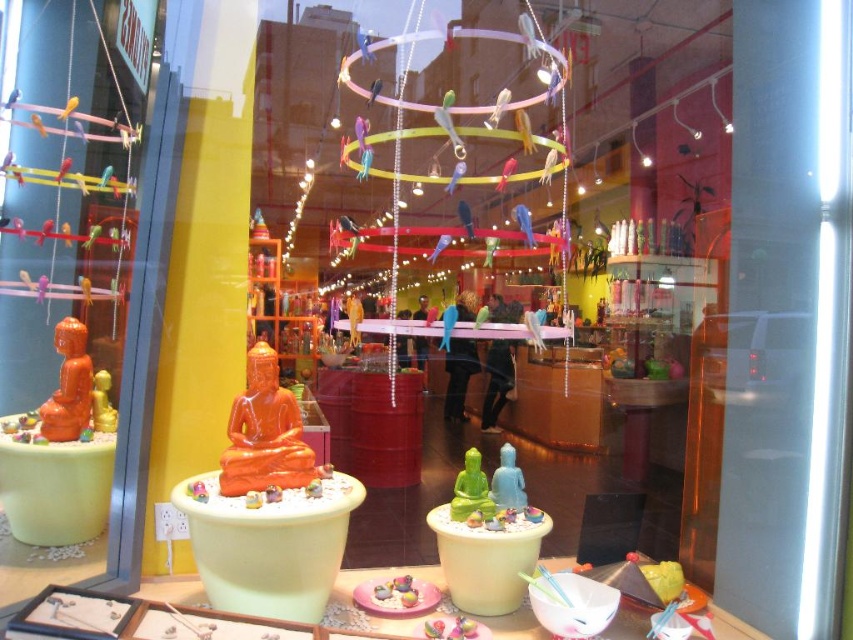
You are a delivery person trying to place a new statue between the orange glossy buddha statue at center and the green matte buddha at center. The statue you have is 16 inches wide. Can it fit in the space between them?

The space between the orange glossy buddha statue at center and the green matte buddha at center is 18.14 inches. Since the statue you have is 16 inches wide, it should fit with some space remaining.

You are a customer looking at the display of orange matte buddha at left and green matte buddha at center. Which one is located more to the left?

The orange matte buddha at left is more to the left than the green matte buddha at center because the orange matte buddha at left is positioned on the left side of green matte buddha at center.

You are standing in front of the vibrant storefront display and notice two points marked in the scene. Which point, point [55,392] or point [94,412], is closer to you?

Point [55,392] is closer to the viewer than point [94,412].